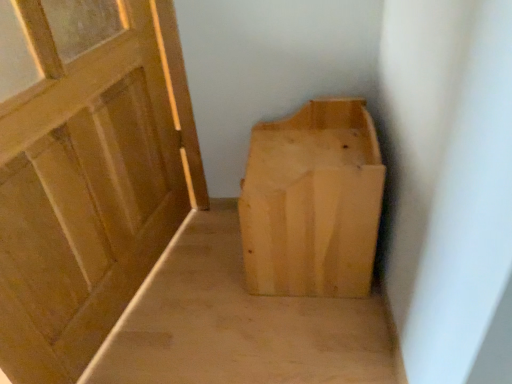
Question: Is light wood/rough textured box at center taller than light wood bench at center?

Choices:
 (A) yes
 (B) no

Answer: (A)

Question: Is light wood/rough textured box at center at the right side of light wood bench at center?

Choices:
 (A) no
 (B) yes

Answer: (B)

Question: Is light wood/rough textured box at center oriented away from light wood bench at center?

Choices:
 (A) yes
 (B) no

Answer: (B)

Question: Is light wood/rough textured box at center aimed at light wood bench at center?

Choices:
 (A) yes
 (B) no

Answer: (A)

Question: Is light wood bench at center a part of light wood/rough textured box at center?

Choices:
 (A) no
 (B) yes

Answer: (A)

Question: From the image's perspective, is light wood/rough textured box at center located above or below matte wood door at left?

Choices:
 (A) above
 (B) below

Answer: (B)

Question: Considering the positions of light wood/rough textured box at center and matte wood door at left in the image, is light wood/rough textured box at center bigger or smaller than matte wood door at left?

Choices:
 (A) small
 (B) big

Answer: (A)

Question: From a real-world perspective, is light wood/rough textured box at center above or below matte wood door at left?

Choices:
 (A) below
 (B) above

Answer: (A)

Question: Is point (333, 190) positioned closer to the camera than point (54, 34)?

Choices:
 (A) closer
 (B) farther

Answer: (A)

Question: Is point (8, 107) closer or farther from the camera than point (325, 163)?

Choices:
 (A) closer
 (B) farther

Answer: (A)

Question: Relative to light wood/rough textured box at center, is matte wood door at left in front or behind?

Choices:
 (A) front
 (B) behind

Answer: (A)

Question: Based on their positions, is matte wood door at left located to the left or right of light wood/rough textured box at center?

Choices:
 (A) right
 (B) left

Answer: (B)

Question: From a real-world perspective, is matte wood door at left above or below light wood/rough textured box at center?

Choices:
 (A) below
 (B) above

Answer: (B)

Question: From a real-world perspective, is matte wood door at left physically located above or below light wood bench at center?

Choices:
 (A) above
 (B) below

Answer: (A)

Question: Does point (88, 258) appear closer or farther from the camera than point (351, 375)?

Choices:
 (A) closer
 (B) farther

Answer: (B)